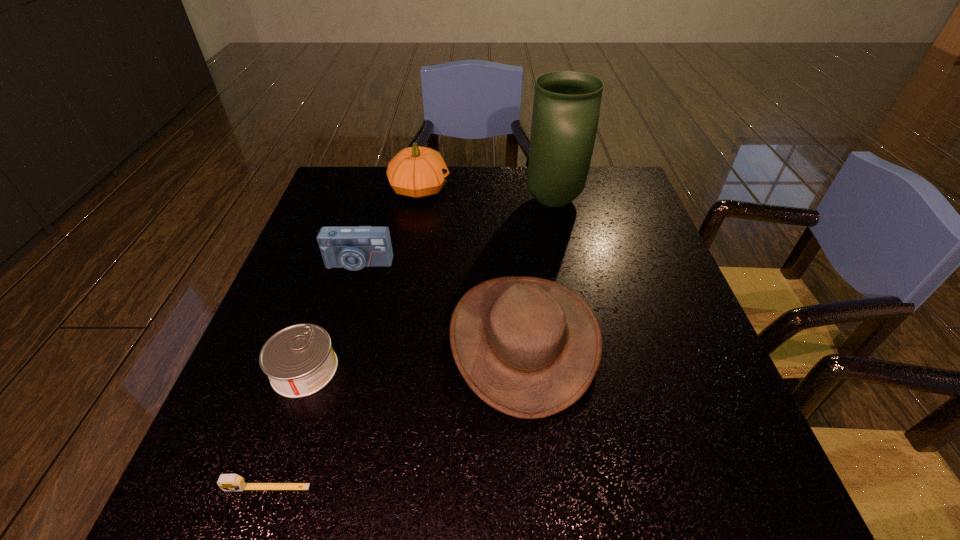
Select which object is the fifth closest to the fifth shortest object. Please provide its 2D coordinates. Your answer should be formatted as a tuple, i.e. [(x, y)], where the tuple contains the x and y coordinates of a point satisfying the conditions above.

[(227, 482)]

Locate which object is the third closest to the second shortest object. Please provide its 2D coordinates. Your answer should be formatted as a tuple, i.e. [(x, y)], where the tuple contains the x and y coordinates of a point satisfying the conditions above.

[(529, 347)]

Where is `free point that satisfies the following two spatial constraints: 1. on the side of the vase with the carved face; 2. on the right side of the second tallest object`? The height and width of the screenshot is (540, 960). free point that satisfies the following two spatial constraints: 1. on the side of the vase with the carved face; 2. on the right side of the second tallest object is located at coordinates (418, 200).

Find the location of a particular element. vacant point that satisfies the following two spatial constraints: 1. on the side of the second tallest object with the carved face; 2. on the right side of the cowboy hat is located at coordinates (393, 339).

Where is `free space that satisfies the following two spatial constraints: 1. on the side of the fifth shortest object with the carved face; 2. on the back side of the vase`? free space that satisfies the following two spatial constraints: 1. on the side of the fifth shortest object with the carved face; 2. on the back side of the vase is located at coordinates (418, 200).

Where is `free space that satisfies the following two spatial constraints: 1. on the side of the gourd with the carved face; 2. on the front side of the second shortest object`? free space that satisfies the following two spatial constraints: 1. on the side of the gourd with the carved face; 2. on the front side of the second shortest object is located at coordinates (388, 370).